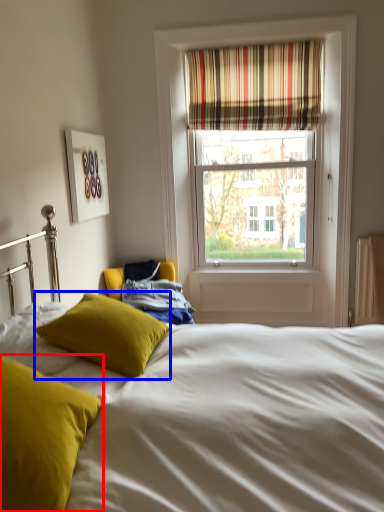
Question: Among these objects, which one is nearest to the camera, pillow (highlighted by a red box) or pillow (highlighted by a blue box)?

Choices:
 (A) pillow
 (B) pillow

Answer: (A)